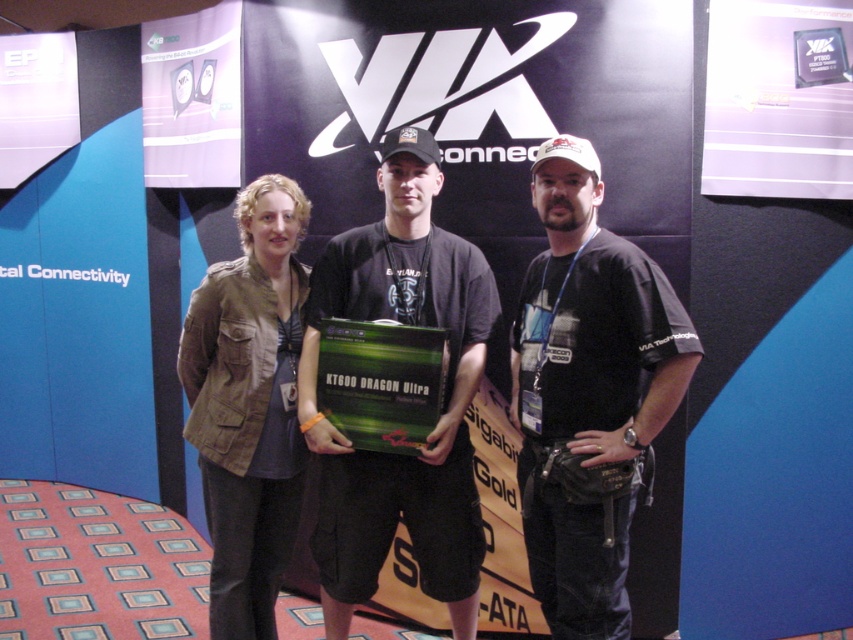
You are observing the promotional backdrop at the exhibition. There are two people in front of it. One is wearing a matte black shirt at center and the other a khaki fabric jacket at left. From the perspective of someone standing in front of the backdrop, which clothing item is positioned higher?

The matte black shirt at center is located above the khaki fabric jacket at left, so the matte black shirt at center is positioned higher.